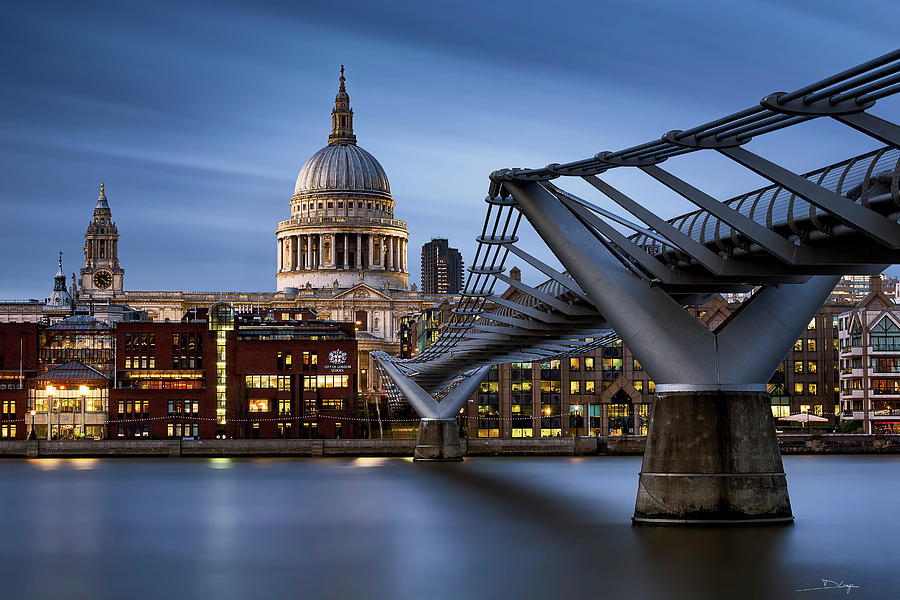
You are a GUI agent. You are given a task and a screenshot of the screen. Output one action in this format:
    pyautogui.click(x=<x>, y=<y>)
    Task: Click on the line of lights
    The height and width of the screenshot is (600, 900).
    Given the screenshot: What is the action you would take?
    pyautogui.click(x=218, y=349), pyautogui.click(x=218, y=365), pyautogui.click(x=218, y=379), pyautogui.click(x=218, y=402)